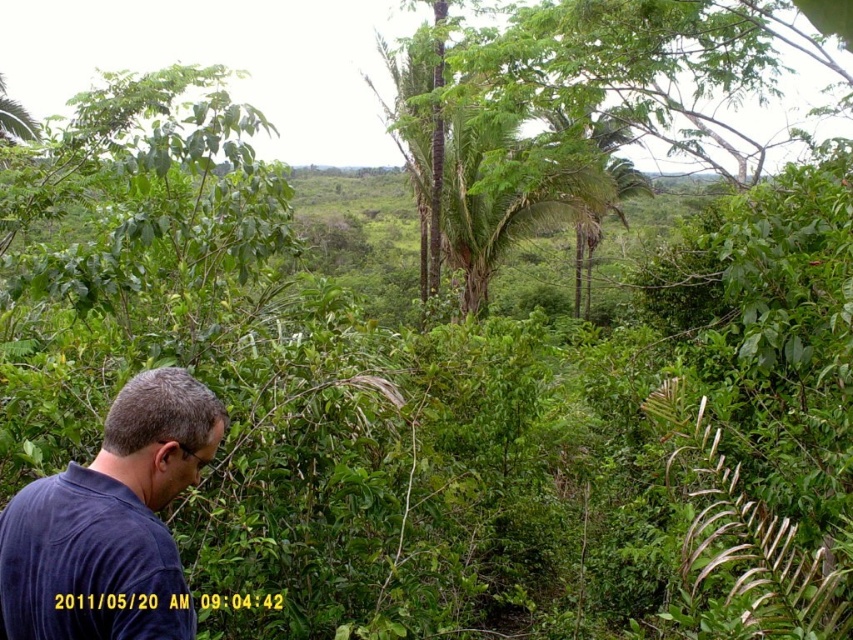
You are standing in the tropical landscape and want to take a photo of the green leafy tree at center. Where should you position yourself to capture it in the frame?

The green leafy tree at center is located at the coordinates 0.116 on the x axis and 0.709 on the y axis, so you should position yourself facing towards those coordinates to capture it in the frame.

Looking at this image, you are standing in the tropical landscape and want to take a photo of the green leafy tree at center while avoiding the dark blue shirt at lower left from appearing in the shot. Which direction should you move to ensure the tree is still visible but the shirt is out of frame?

Move to the left side of the green leafy tree at center. Since the green leafy tree at center is to the right of the dark blue shirt at lower left, moving left would position the tree between you and the shirt, keeping the tree in view while blocking the shirt from the frame.